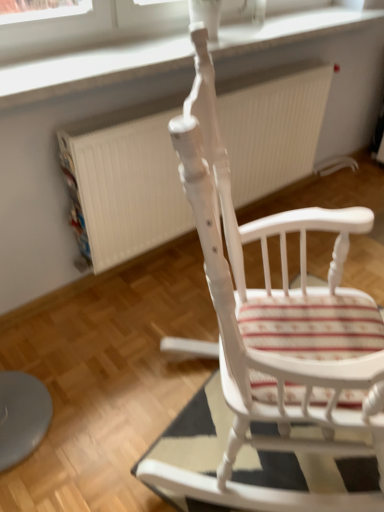
Question: From the image's perspective, is white plastic window frame at upper center on top of white painted wood rocking chair at center?

Choices:
 (A) no
 (B) yes

Answer: (B)

Question: Can you confirm if white plastic window frame at upper center is wider than white painted wood rocking chair at center?

Choices:
 (A) no
 (B) yes

Answer: (A)

Question: From a real-world perspective, is white plastic window frame at upper center on white painted wood rocking chair at center?

Choices:
 (A) yes
 (B) no

Answer: (A)

Question: Does white plastic window frame at upper center have a greater height compared to white painted wood rocking chair at center?

Choices:
 (A) yes
 (B) no

Answer: (B)

Question: Can you confirm if white plastic window frame at upper center is positioned to the left of white painted wood rocking chair at center?

Choices:
 (A) yes
 (B) no

Answer: (A)

Question: Considering the positions of white painted wood rocking chair at center and white textured radiator at center in the image, is white painted wood rocking chair at center bigger or smaller than white textured radiator at center?

Choices:
 (A) big
 (B) small

Answer: (A)

Question: Relative to white textured radiator at center, is white painted wood rocking chair at center in front or behind?

Choices:
 (A) behind
 (B) front

Answer: (B)

Question: In the image, is white painted wood rocking chair at center on the left side or the right side of white textured radiator at center?

Choices:
 (A) right
 (B) left

Answer: (A)

Question: Choose the correct answer: Is white painted wood rocking chair at center inside white textured radiator at center or outside it?

Choices:
 (A) outside
 (B) inside

Answer: (A)

Question: Considering the relative positions of striped fabric mat at center and white textured radiator at center in the image provided, is striped fabric mat at center to the left or to the right of white textured radiator at center?

Choices:
 (A) right
 (B) left

Answer: (A)

Question: From the image's perspective, is striped fabric mat at center above or below white textured radiator at center?

Choices:
 (A) above
 (B) below

Answer: (B)

Question: In the image, is striped fabric mat at center positioned in front of or behind white textured radiator at center?

Choices:
 (A) behind
 (B) front

Answer: (B)

Question: Considering the positions of striped fabric mat at center and white textured radiator at center in the image, is striped fabric mat at center wider or thinner than white textured radiator at center?

Choices:
 (A) wide
 (B) thin

Answer: (A)

Question: From the image's perspective, relative to white painted wood rocking chair at center, is white plastic window frame at upper center above or below?

Choices:
 (A) below
 (B) above

Answer: (B)

Question: Is point (34, 81) positioned closer to the camera than point (241, 417)?

Choices:
 (A) closer
 (B) farther

Answer: (B)